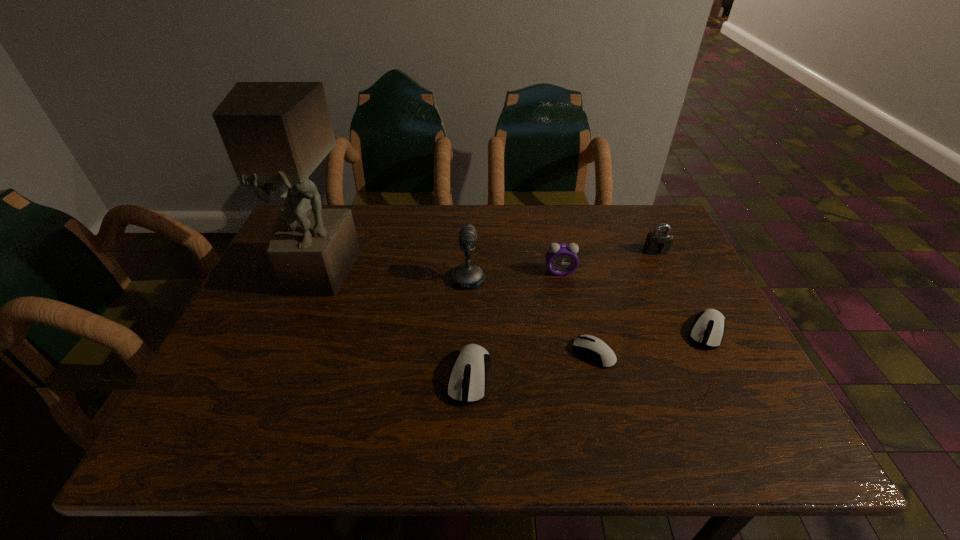
In order to click on alarm clock in this screenshot , I will do `click(561, 259)`.

The height and width of the screenshot is (540, 960). I want to click on blank space located 0.080m on the right of the leftmost mouse, so tap(529, 376).

This screenshot has width=960, height=540. Find the location of `free spot located 0.320m on the back of the shortest mouse`. free spot located 0.320m on the back of the shortest mouse is located at coordinates tap(569, 251).

Image resolution: width=960 pixels, height=540 pixels. In order to click on vacant space located on the left of the second shortest object in this screenshot , I will do `click(516, 332)`.

Locate an element on the screen. The image size is (960, 540). vacant space positioned on the front-facing side of the leftmost object is located at coordinates (300, 319).

At what (x,y) coordinates should I click in order to perform the action: click on blank space located 0.240m on the front-facing side of the second tallest object. Please return your answer as a coordinate pair (x, y). This screenshot has height=540, width=960. Looking at the image, I should click on (576, 279).

Where is `free region located 0.280m at the front of the padlock near the keyhole`? Image resolution: width=960 pixels, height=540 pixels. free region located 0.280m at the front of the padlock near the keyhole is located at coordinates (694, 332).

Find the location of a particular element. The height and width of the screenshot is (540, 960). vacant region located 0.200m on the face of the alarm clock is located at coordinates point(572,334).

Image resolution: width=960 pixels, height=540 pixels. Find the location of `sculpture situated at the far edge`. sculpture situated at the far edge is located at coordinates (275, 133).

Find the location of `padlock situated at the far edge`. padlock situated at the far edge is located at coordinates (658, 242).